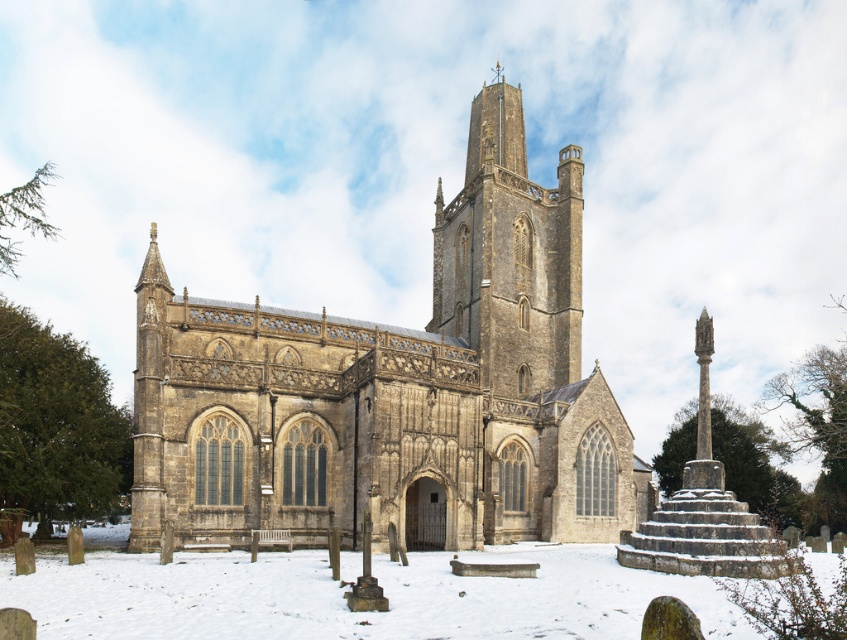
Does point (458, 636) come in front of point (473, 196)?

Yes, it is.

Does white powdery snow at center appear on the left side of brown stone tower at center?

Yes, white powdery snow at center is to the left of brown stone tower at center.

Is point (591, 563) positioned before point (479, 193)?

Yes.

Where is `white powdery snow at center`? The width and height of the screenshot is (847, 640). white powdery snow at center is located at coordinates (344, 600).

Can you confirm if stone church at center is thinner than brown stone tower at center?

In fact, stone church at center might be wider than brown stone tower at center.

Does stone church at center lie in front of brown stone tower at center?

Yes, it is.

Where is `stone church at center`? stone church at center is located at coordinates (396, 388).

Between point (172, 476) and point (563, 634), which one is positioned in front?

Point (563, 634) is more forward.

Find the location of a particular element. This screenshot has width=847, height=640. stone church at center is located at coordinates (396, 388).